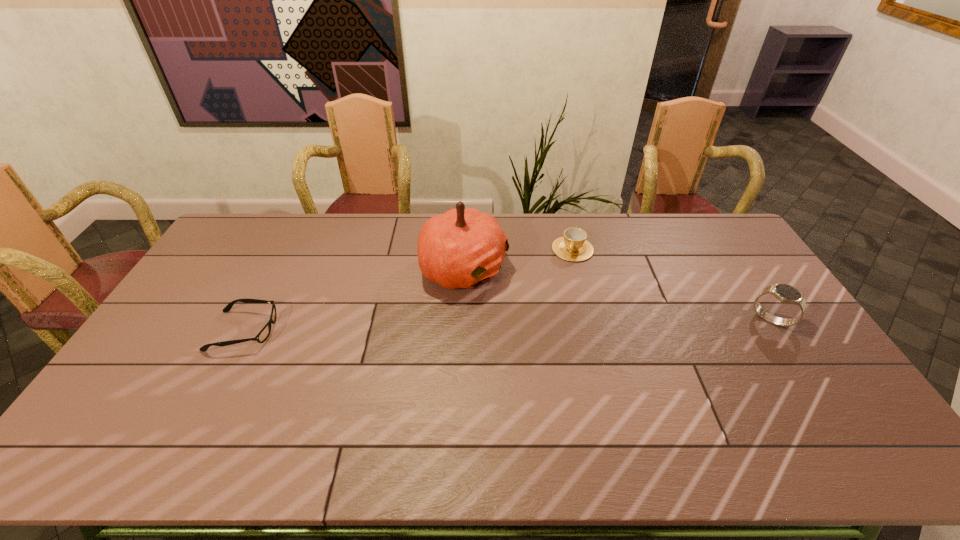
At what (x,y) coordinates should I click in order to perform the action: click on free space located 0.160m on the front-facing side of the pumpkin. Please return your answer as a coordinate pair (x, y). This screenshot has height=540, width=960. Looking at the image, I should click on (544, 306).

At what (x,y) coordinates should I click in order to perform the action: click on free space located 0.240m on the front-facing side of the pumpkin. Please return your answer as a coordinate pair (x, y). Looking at the image, I should click on (567, 316).

Where is `vacant space located on the front-facing side of the pumpkin`? Image resolution: width=960 pixels, height=540 pixels. vacant space located on the front-facing side of the pumpkin is located at coordinates (613, 338).

Locate an element on the screen. blank space located with the handle on the side of the cup is located at coordinates (548, 319).

The height and width of the screenshot is (540, 960). I want to click on vacant area located with the handle on the side of the cup, so point(539,345).

Where is `vacant space located 0.380m with the handle on the side of the cup`? The width and height of the screenshot is (960, 540). vacant space located 0.380m with the handle on the side of the cup is located at coordinates 540,340.

At what (x,y) coordinates should I click in order to perform the action: click on pumpkin that is at the far edge. Please return your answer as a coordinate pair (x, y). Looking at the image, I should click on (461, 248).

Locate an element on the screen. cup present at the far edge is located at coordinates (573, 246).

I want to click on object positioned at the left edge, so click(x=262, y=336).

The height and width of the screenshot is (540, 960). What are the coordinates of `object present at the right edge` in the screenshot? It's located at (785, 293).